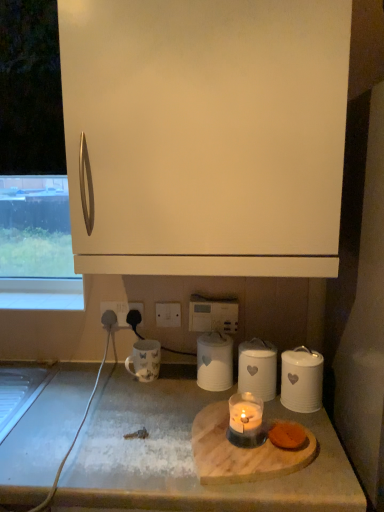
The image size is (384, 512). I want to click on free location in front of white ceramic canister at center, positioned as the 1th kitchen appliance in left-to-right order, so click(x=189, y=409).